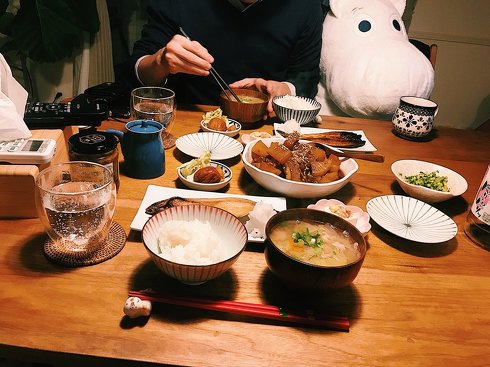
Where is `nose of plushie`? The width and height of the screenshot is (490, 367). nose of plushie is located at coordinates (390, 79).